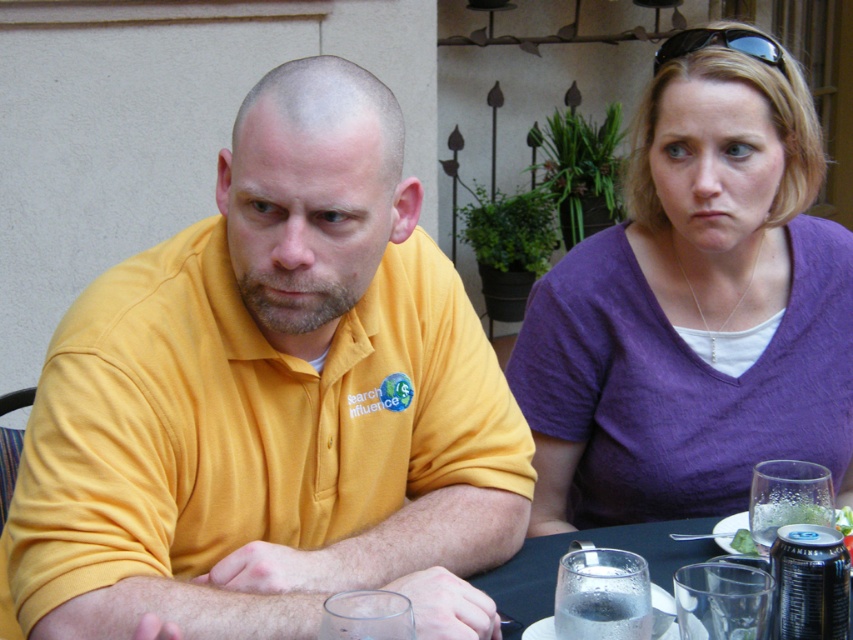
I want to click on purple cotton shirt at upper right, so click(x=693, y=310).

Who is positioned more to the right, purple cotton shirt at upper right or green leafy vegetable at lower right?

Result: Positioned to the right is purple cotton shirt at upper right.

Which is in front, point (801, 344) or point (741, 529)?

Point (741, 529)

At what (x,y) coordinates should I click in order to perform the action: click on purple cotton shirt at upper right. Please return your answer as a coordinate pair (x, y). Image resolution: width=853 pixels, height=640 pixels. Looking at the image, I should click on (693, 310).

Between purple cotton shirt at upper right and clear glass at table, which one appears on the right side from the viewer's perspective?

Positioned to the right is purple cotton shirt at upper right.

Which is more to the left, purple cotton shirt at upper right or clear glass at table?

clear glass at table is more to the left.

At what (x,y) coordinates should I click in order to perform the action: click on purple cotton shirt at upper right. Please return your answer as a coordinate pair (x, y). The height and width of the screenshot is (640, 853). Looking at the image, I should click on (693, 310).

In order to click on purple cotton shirt at upper right in this screenshot , I will do `click(693, 310)`.

Which is below, metallic silver can at lower right or clear glass at table?

clear glass at table is below.

Who is more forward, (x=821, y=557) or (x=564, y=612)?

Point (x=821, y=557) is in front.

Locate an element on the screen. The width and height of the screenshot is (853, 640). metallic silver can at lower right is located at coordinates pos(809,582).